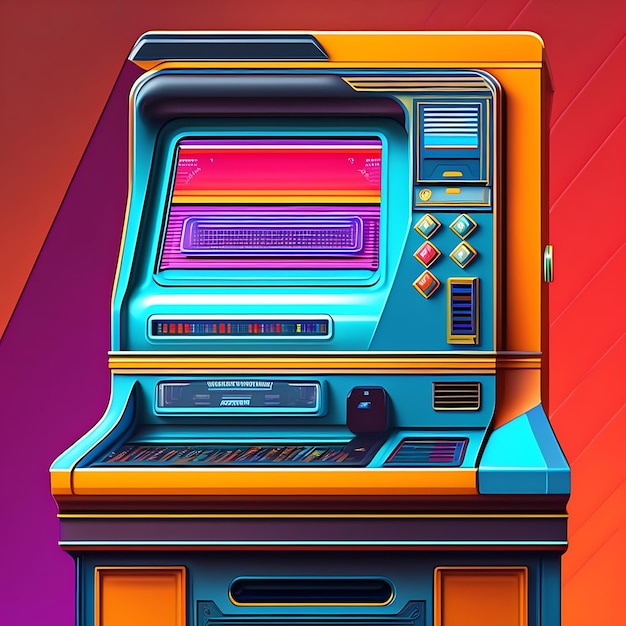
You are a GUI agent. You are given a task and a screenshot of the screen. Output one action in this format:
    pyautogui.click(x=<x>, y=<y>)
    Task: Click on the vent
    The height and width of the screenshot is (626, 626).
    Given the screenshot: What is the action you would take?
    pyautogui.click(x=454, y=391), pyautogui.click(x=294, y=593)